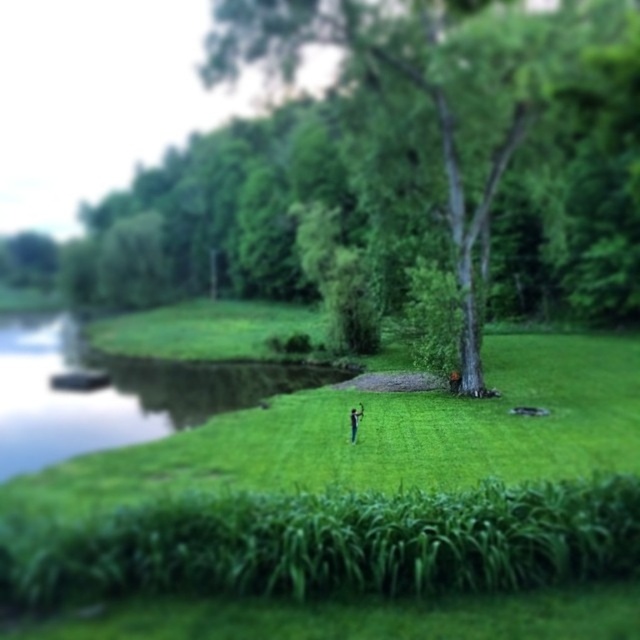
You are a photographer trying to capture a photo of the green leafy tree at center and the brown leather jacket at center in the image. If you want to include both in the frame without moving the camera, which object should you focus on to ensure the tree is in focus while the jacket remains sharp?

Since the green leafy tree at center is much taller than the brown leather jacket at center, focusing on the tree will keep it sharp while the jacket may still be in focus due to its proximity to the tree in the depth of field.

You are standing in the meadow and want to take a photo of the brown leather jacket at center without the green leafy tree at center blocking it. How should you adjust your position?

To avoid the green leafy tree at center blocking the brown leather jacket at center, you should move sideways to the left or right since the tree is in front of the jacket at the same center position.

You are a photographer trying to capture a photo of the blue fabric person at center and the brown leather jacket at center. Which object should you focus on if you want to highlight the one that is taller?

The brown leather jacket at center is taller than the blue fabric person at center, so you should focus on the brown leather jacket at center to highlight its height.